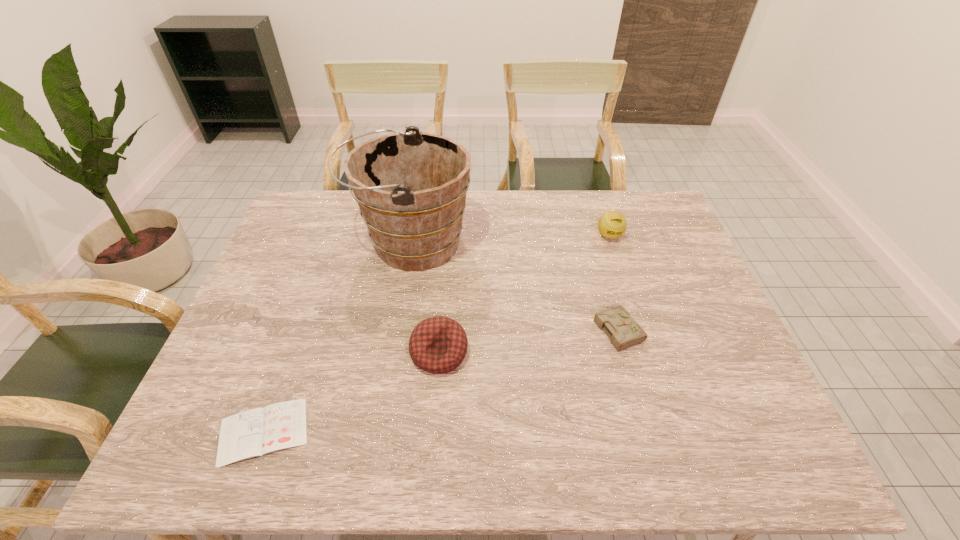
At what (x,y) coordinates should I click in order to perform the action: click on bucket. Please return your answer as a coordinate pair (x, y). Image resolution: width=960 pixels, height=540 pixels. Looking at the image, I should click on tap(411, 187).

Where is `softball`? The height and width of the screenshot is (540, 960). softball is located at coordinates (612, 224).

This screenshot has width=960, height=540. In order to click on beanbag in this screenshot , I will do `click(438, 345)`.

At what (x,y) coordinates should I click in order to perform the action: click on the taller diary. Please return your answer as a coordinate pair (x, y). Looking at the image, I should click on pos(624,332).

The image size is (960, 540). I want to click on the right diary, so click(x=624, y=332).

Locate an element on the screen. the shortest object is located at coordinates (255, 432).

Locate an element on the screen. This screenshot has width=960, height=540. the nearest object is located at coordinates (255, 432).

Locate an element on the screen. The height and width of the screenshot is (540, 960). vacant region located on the handle side of the bucket is located at coordinates [325, 242].

The height and width of the screenshot is (540, 960). What are the coordinates of `vacant region located on the handle side of the bucket` in the screenshot? It's located at (335, 242).

You are a GUI agent. You are given a task and a screenshot of the screen. Output one action in this format:
    pyautogui.click(x=<x>, y=<y>)
    Task: Click on the vacant space positioned 0.060m on the handle side of the bucket
    Image resolution: width=960 pixels, height=540 pixels.
    Given the screenshot: What is the action you would take?
    pyautogui.click(x=331, y=242)